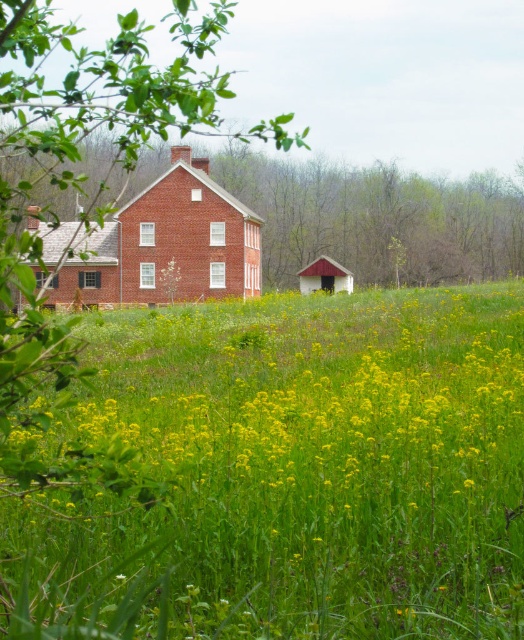
Does green grassy field at center come behind brick house at center?

No, it is in front of brick house at center.

Measure the distance between green grassy field at center and camera.

The distance of green grassy field at center from camera is 8.42 feet.

Is point (311, 490) positioned in front of point (176, 188)?

Yes.

Find the location of a particular element. green grassy field at center is located at coordinates (293, 472).